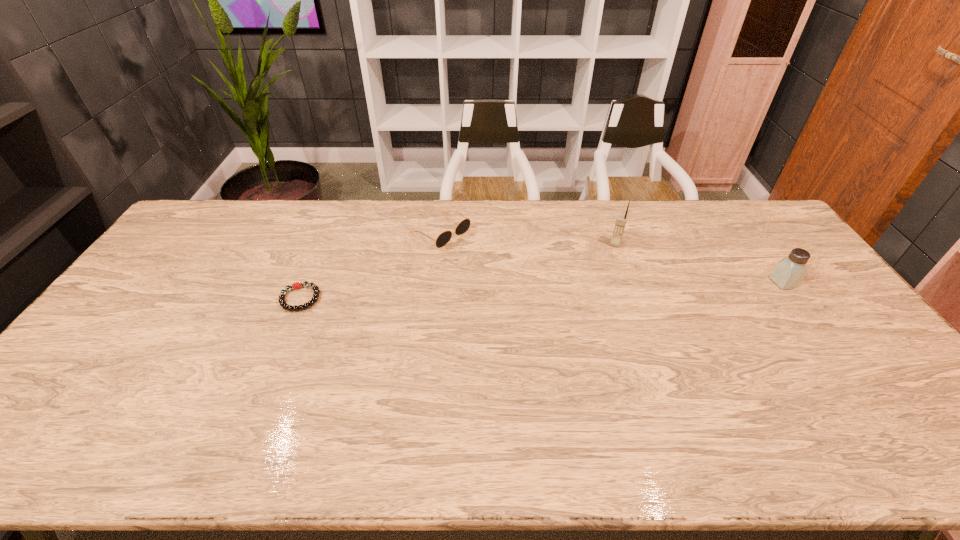
Locate an element on the screen. Image resolution: width=960 pixels, height=540 pixels. vacant space on the desktop that is between the shortest object and the saltshaker and is positioned on the front-facing side of the sunglasses is located at coordinates (538, 291).

This screenshot has height=540, width=960. What are the coordinates of `free space on the desktop that is between the leftmost object and the rightmost object and is positioned on the front of the second object from right to left, where the keypad is located` in the screenshot? It's located at (598, 288).